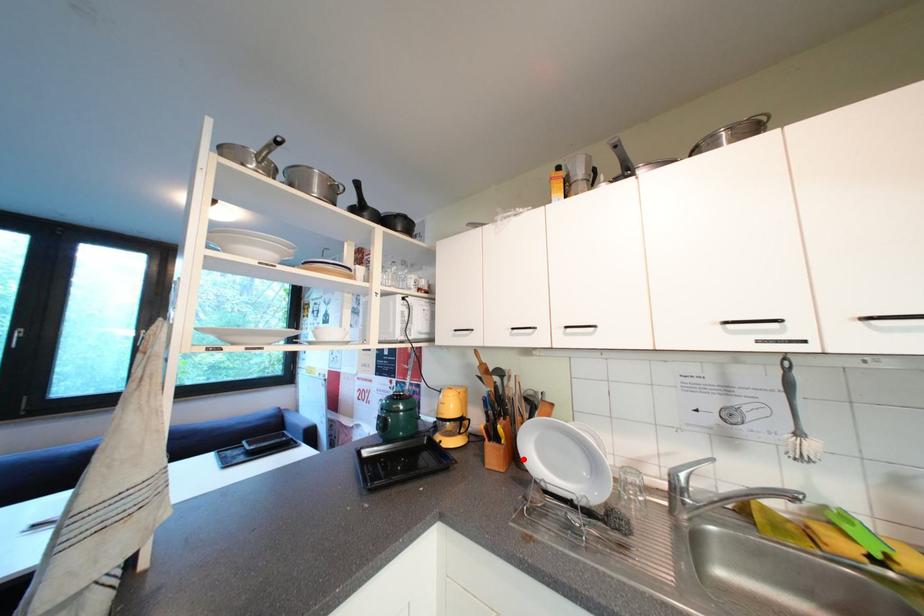
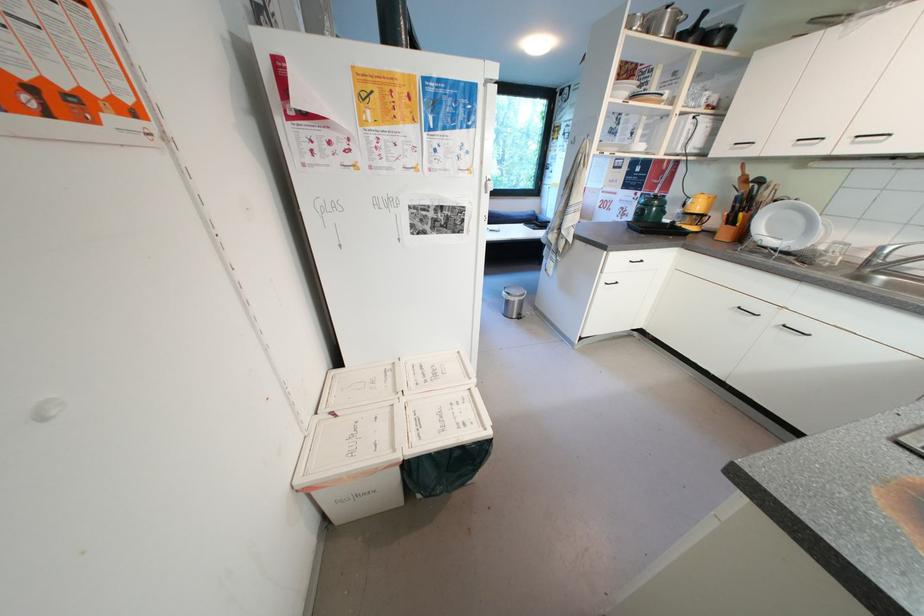
Find the pixel in the second image that matches the highlighted location in the first image.

(749, 238)